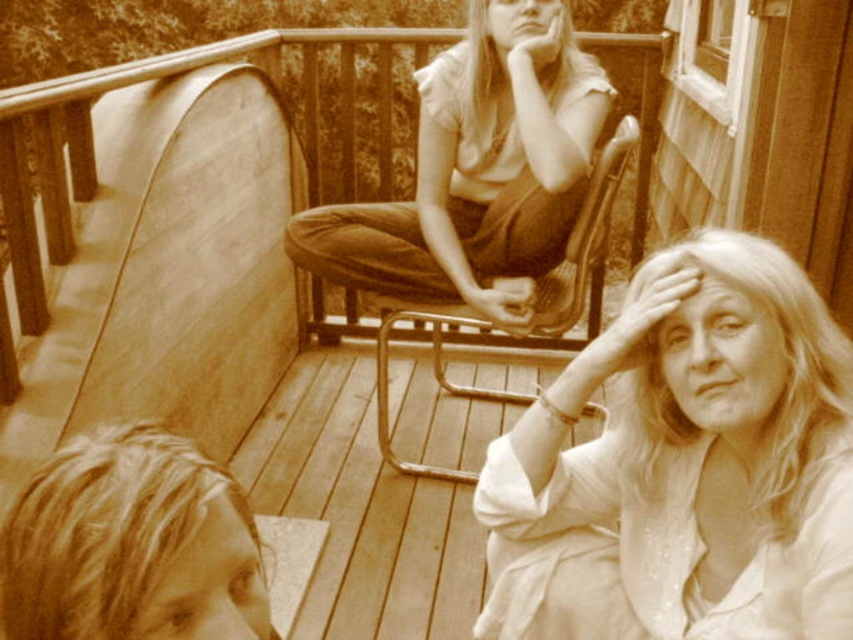
Is smooth white blouse at lower right behind blonde hair at lower left?

Yes, it is.

Can you confirm if smooth white blouse at lower right is positioned to the right of blonde hair at lower left?

Correct, you'll find smooth white blouse at lower right to the right of blonde hair at lower left.

Which is behind, point (741, 552) or point (97, 436)?

Point (741, 552)

I want to click on smooth white blouse at lower right, so click(683, 465).

Between point (668, 632) and point (587, 218), which one is positioned in front?

Point (668, 632) is in front.

Between smooth white blouse at lower right and metallic frame chair at center, which one appears on the left side from the viewer's perspective?

Positioned to the left is metallic frame chair at center.

Describe the element at coordinates (683, 465) in the screenshot. I see `smooth white blouse at lower right` at that location.

What are the coordinates of `smooth white blouse at lower right` in the screenshot? It's located at (683, 465).

Does matte brown pants at center have a lesser width compared to blonde hair at lower left?

Incorrect, matte brown pants at center's width is not less than blonde hair at lower left's.

From the picture: Does matte brown pants at center have a larger size compared to blonde hair at lower left?

Correct, matte brown pants at center is larger in size than blonde hair at lower left.

Find the location of a particular element. matte brown pants at center is located at coordinates (479, 170).